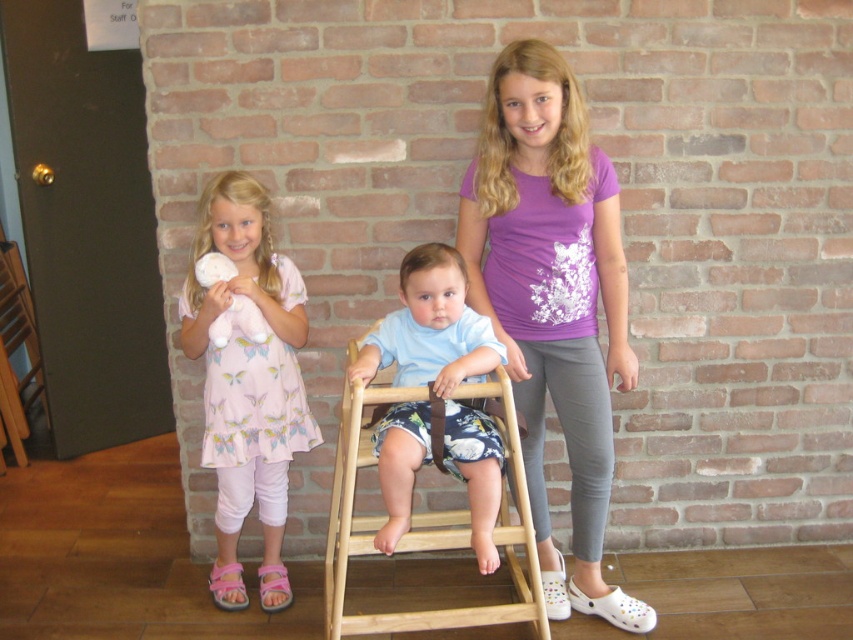
You are a photographer setting up for a group photo. You have to decide whether the pink fabric dress at left and the white plush toy at left will fit within the camera frame if positioned side by side. Based on their widths, can they both fit without overlapping?

The pink fabric dress at left might be wider than the white plush toy at left, so there is a possibility they won

You are a photographer setting up a shot of the children. The pink fabric dress at left and the white plush toy at left are both in the frame. Which object is positioned closer to the camera?

The pink fabric dress at left is closer to the viewer than the white plush toy at left, so the pink fabric dress at left is closer to the camera.